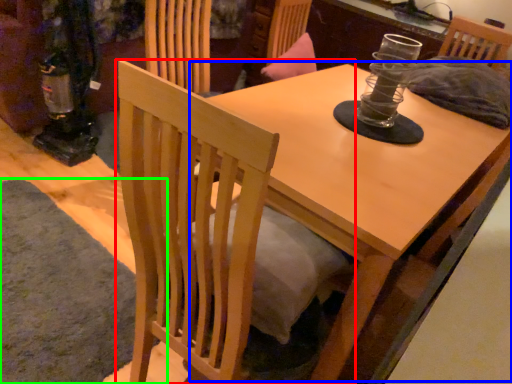
Question: Which object is the closest to the chair (highlighted by a red box)? Choose among these: round table (highlighted by a blue box) or mat (highlighted by a green box).

Choices:
 (A) round table
 (B) mat

Answer: (A)